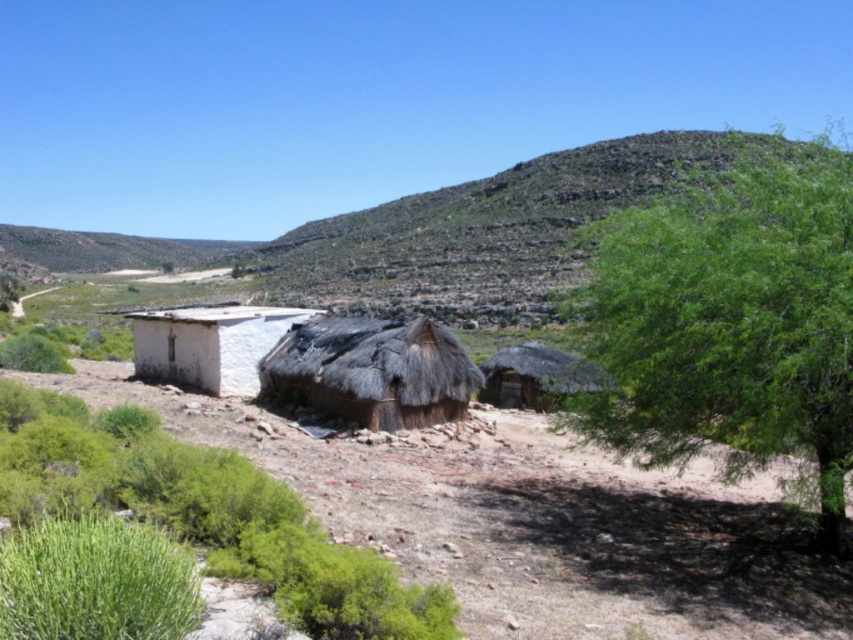
Question: Based on their relative distances, which object is nearer to the green leafy tree at right?

Choices:
 (A) white thatch hut at left
 (B) green leafy shrubs at lower left

Answer: (B)

Question: Among these points, which one is farthest from the camera?

Choices:
 (A) (207, 312)
 (B) (534, 342)
 (C) (816, 442)

Answer: (B)

Question: Where is brown thatch hut at center located in relation to white thatch hut at left in the image?

Choices:
 (A) left
 (B) right

Answer: (B)

Question: Can you confirm if brown thatch hut at center is positioned to the right of thatched brown hut at center?

Choices:
 (A) yes
 (B) no

Answer: (B)

Question: Does green leafy tree at right appear over brown thatch hut at center?

Choices:
 (A) yes
 (B) no

Answer: (A)

Question: Estimate the real-world distances between objects in this image. Which object is farther from the thatched brown hut at center?

Choices:
 (A) white thatch hut at left
 (B) green leafy tree at right
 (C) green leafy shrubs at lower left

Answer: (B)